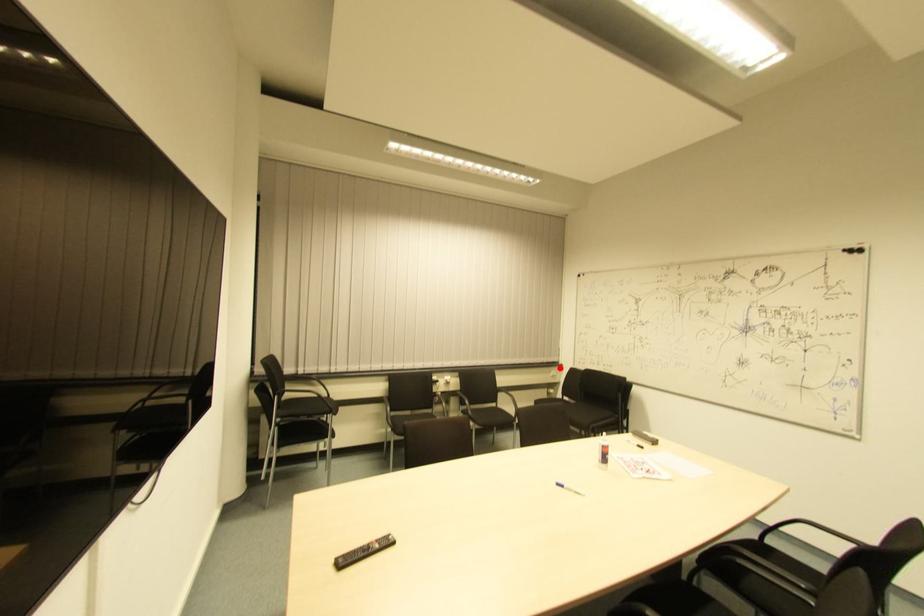
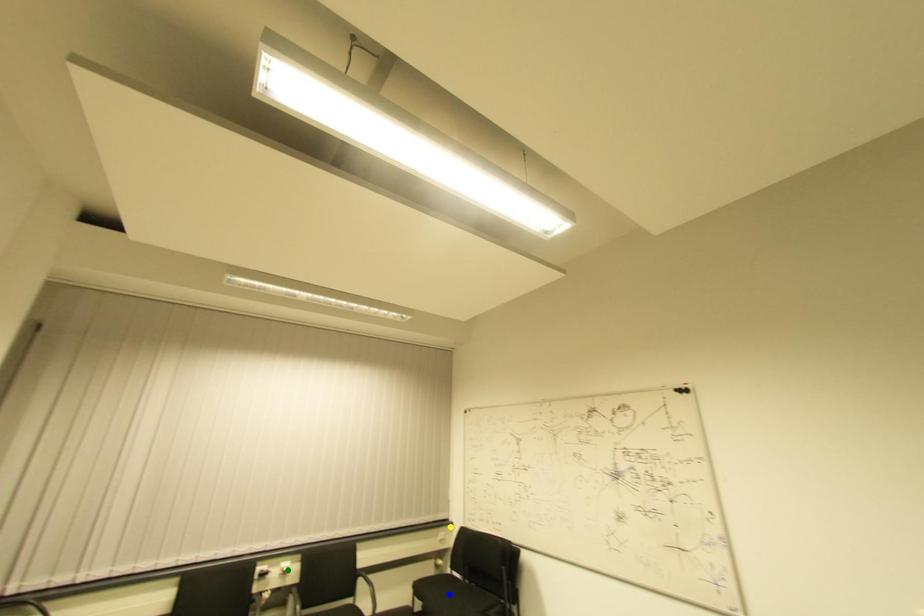
Question: I am providing you with two images of the same scene from different viewpoints. A red point is marked on the first image. You are given multiple points on the second image. Which point in image 2 is actually the same real-world point as the red point in image 1?

Choices:
 (A) blue point
 (B) yellow point
 (C) green point

Answer: (B)